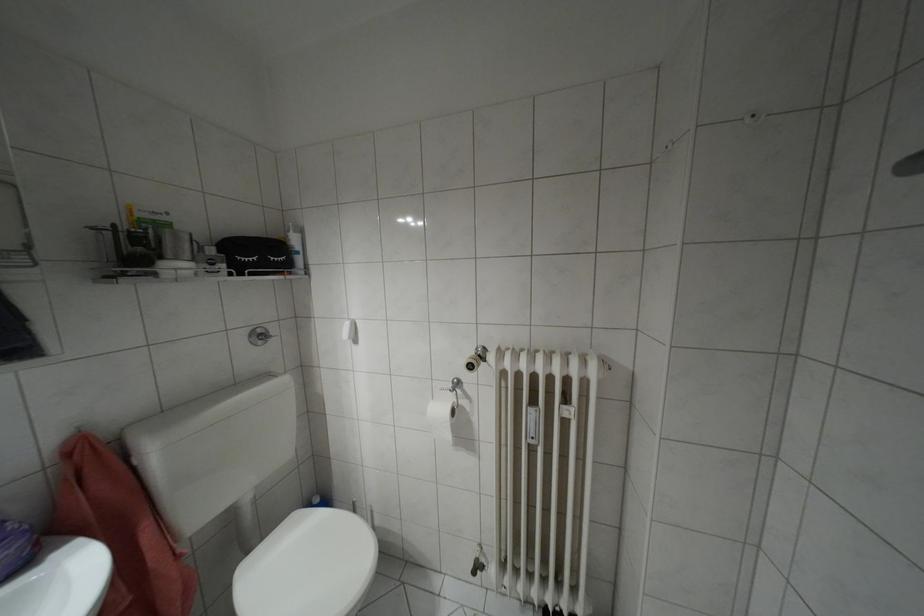
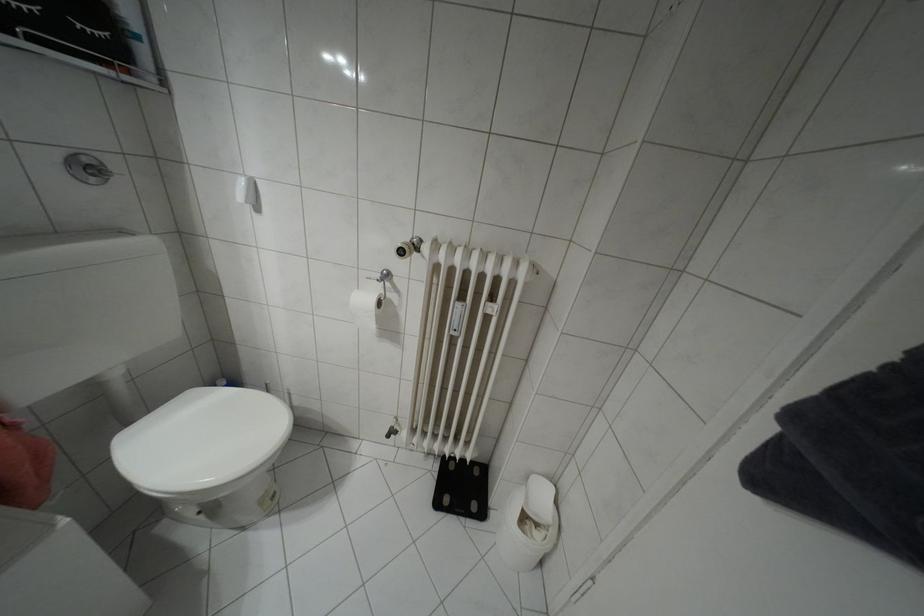
Based on the continuous images, in which direction is the camera rotating?

The rotation direction of the camera is right-down.